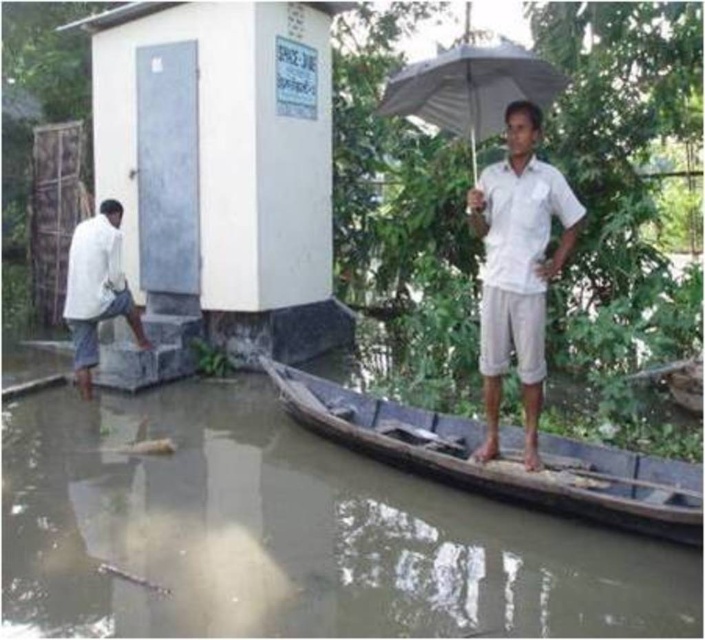
Does white painted concrete hut at left appear over white matte umbrella at upper center?

Indeed, white painted concrete hut at left is positioned over white matte umbrella at upper center.

Is white painted concrete hut at left bigger than white matte umbrella at upper center?

Yes, white painted concrete hut at left is bigger than white matte umbrella at upper center.

Is point (269, 68) farther from viewer compared to point (455, 115)?

Yes, it is.

Find the location of `white painted concrete hut at left`. white painted concrete hut at left is located at coordinates (223, 164).

Measure the distance between brown wooden boat at lower center and camera.

11.97 feet

You are a GUI agent. You are given a task and a screenshot of the screen. Output one action in this format:
    pyautogui.click(x=<x>, y=<y>)
    Task: Click on the brown wooden boat at lower center
    The width and height of the screenshot is (705, 640).
    Given the screenshot: What is the action you would take?
    pyautogui.click(x=288, y=536)

Is point (61, 602) farther from camera compared to point (470, 93)?

No, (61, 602) is closer to viewer.

Where is `brown wooden boat at lower center`? This screenshot has height=640, width=705. brown wooden boat at lower center is located at coordinates (288, 536).

Looking at this image, can you confirm if wooden boat at lower center is positioned above white matte shirt at left?

No.

Who is more distant from viewer, (448, 436) or (75, 349)?

The point (75, 349) is behind.

At what (x,y) coordinates should I click in order to perform the action: click on wooden boat at lower center. Please return your answer as a coordinate pair (x, y). This screenshot has width=705, height=640. Looking at the image, I should click on (501, 460).

Locate an element on the screen. This screenshot has height=640, width=705. wooden boat at lower center is located at coordinates point(501,460).